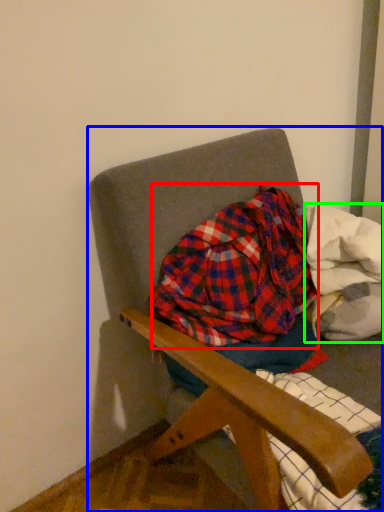
Question: Which object is positioned farthest from flannel (highlighted by a red box)? Select from chair (highlighted by a blue box) and material (highlighted by a green box).

Choices:
 (A) chair
 (B) material

Answer: (A)